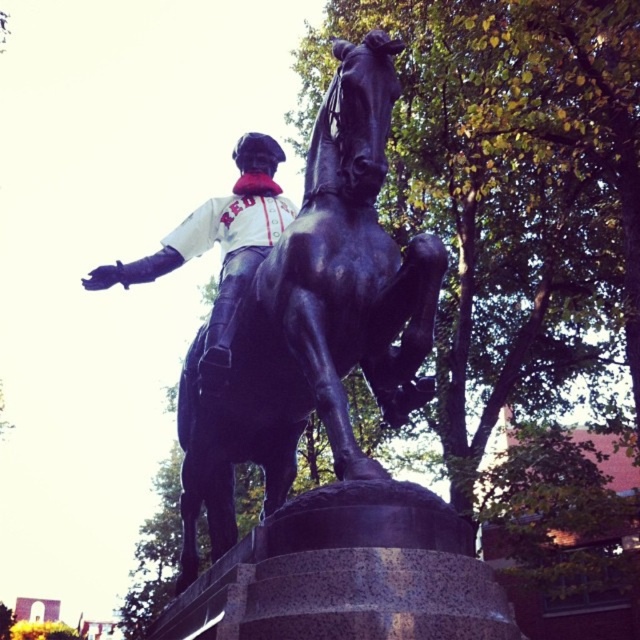
Question: From the image, what is the correct spatial relationship of black polished horse at center in relation to white matte jersey at center?

Choices:
 (A) below
 (B) above

Answer: (A)

Question: Which point is closer to the camera?

Choices:
 (A) (124, 276)
 (B) (419, 348)

Answer: (B)

Question: Which of the following is the farthest from the observer?

Choices:
 (A) white matte jersey at center
 (B) black polished horse at center

Answer: (A)

Question: Is black polished horse at center to the left of white matte jersey at center from the viewer's perspective?

Choices:
 (A) no
 (B) yes

Answer: (A)

Question: Can you confirm if black polished horse at center is wider than white matte jersey at center?

Choices:
 (A) yes
 (B) no

Answer: (A)